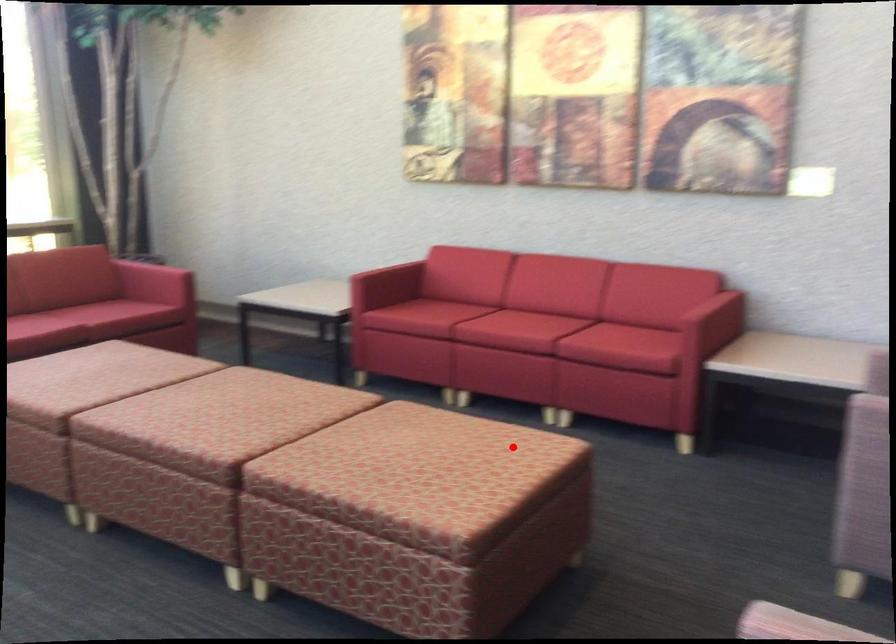
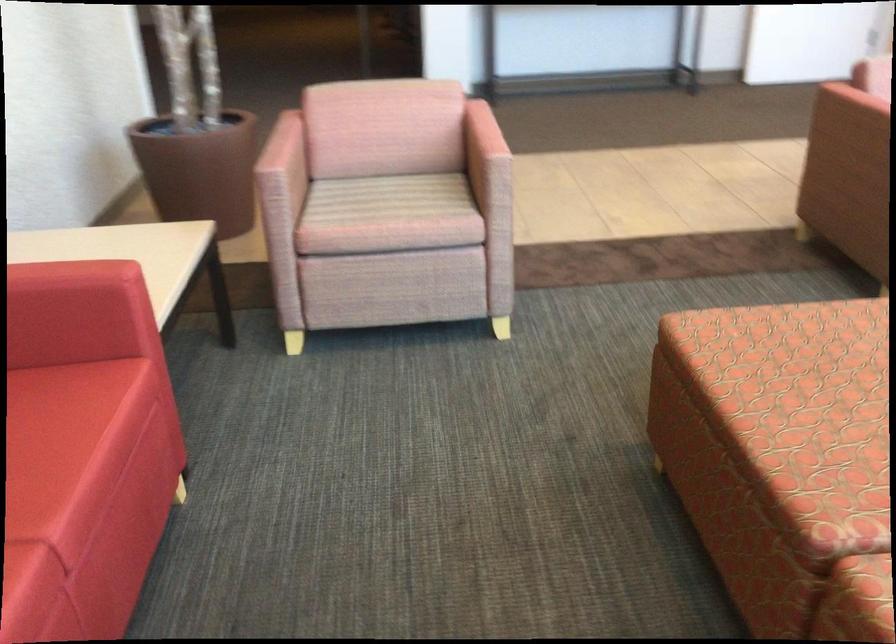
Find the pixel in the second image that matches the highlighted location in the first image.

(782, 350)